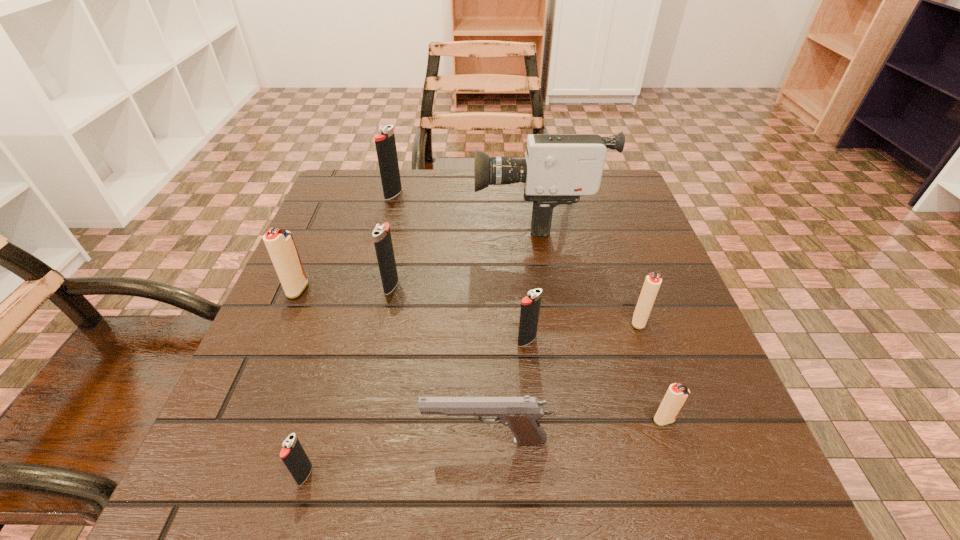
What are the coordinates of `red igniter that can be found as the third closest to the tallest object` in the screenshot? It's located at (676, 395).

Identify the location of free region that satisfies the following two spatial constraints: 1. on the recording direction of the white camcorder; 2. on the front side of the third black igniter from left to right. (548, 286).

Find the location of `blank space that satisfies the following two spatial constraints: 1. on the front side of the biggest red igniter; 2. on the right side of the second biggest red igniter`. blank space that satisfies the following two spatial constraints: 1. on the front side of the biggest red igniter; 2. on the right side of the second biggest red igniter is located at coordinates (284, 321).

At what (x,y) coordinates should I click in order to perform the action: click on free space that satisfies the following two spatial constraints: 1. on the recording direction of the tallest object; 2. on the left side of the fourth farthest igniter. Please return your answer as a coordinate pair (x, y). Looking at the image, I should click on (554, 321).